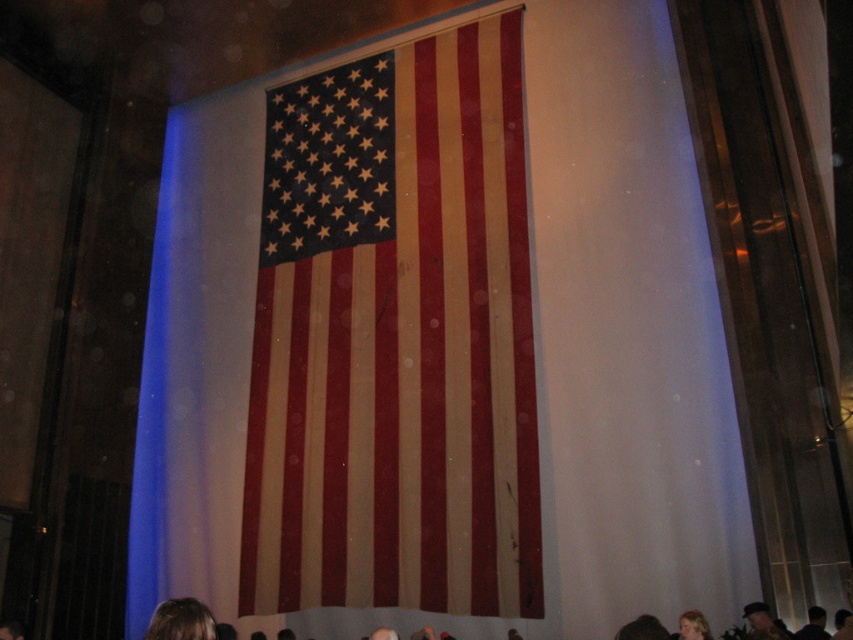
Question: Does blonde hair at lower left appear under dark hair at lower center?

Choices:
 (A) yes
 (B) no

Answer: (B)

Question: From the image, what is the correct spatial relationship of matte fabric flag at center in relation to dark brown hair at lower center?

Choices:
 (A) below
 (B) above

Answer: (A)

Question: Estimate the real-world distances between objects in this image. Which object is farther from the dark hair at lower center?

Choices:
 (A) dark brown hair at lower center
 (B) blonde hair at lower center
 (C) matte fabric flag at center
 (D) blonde hair at lower left

Answer: (D)

Question: Estimate the real-world distances between objects in this image. Which object is closer to the blonde hair at lower left?

Choices:
 (A) dark brown hair at lower center
 (B) matte fabric flag at center

Answer: (A)

Question: Where is camouflage fabric cap at lower right located in relation to blonde hair at lower center in the image?

Choices:
 (A) above
 (B) below

Answer: (B)

Question: Which point is farther from the camera taking this photo?

Choices:
 (A) (634, 621)
 (B) (505, 125)

Answer: (B)